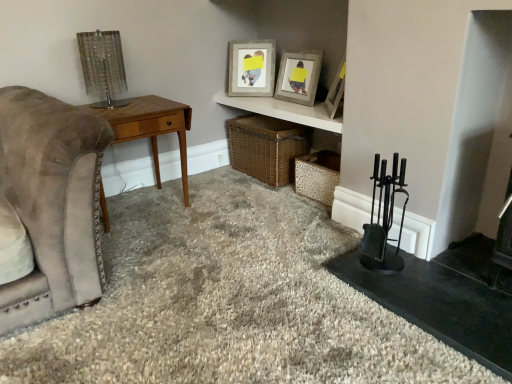
Describe the element at coordinates (151, 127) in the screenshot. I see `wooden desk at left` at that location.

Locate an element on the screen. wooden picture frame at upper center, which appears as the first picture frame when viewed from the right is located at coordinates (336, 91).

The width and height of the screenshot is (512, 384). I want to click on wooden picture frame at upper center, the second picture frame in the left-to-right sequence, so click(x=298, y=76).

Is woven brown basket at center, the second crate in the right-to-left sequence, inside the boundaries of wooden desk at left, or outside?

woven brown basket at center, the second crate in the right-to-left sequence, cannot be found inside wooden desk at left.

Is point (290, 154) more distant than point (143, 102)?

Yes, it is.

From a real-world perspective, is woven brown basket at center, which ranks as the first crate in left-to-right order, on wooden desk at left?

Incorrect, from a real-world perspective, woven brown basket at center, which ranks as the first crate in left-to-right order, is lower than wooden desk at left.

Does woven brown basket at center, which ranks as the first crate in left-to-right order, lie behind wooden desk at left?

Yes, woven brown basket at center, which ranks as the first crate in left-to-right order, is further from the viewer.

From a real-world perspective, which object rests below the other?

matte wooden shelf at upper center is physically lower.

Is metallic mesh lamp at upper left next to matte wooden shelf at upper center?

No.

Is metallic mesh lamp at upper left inside the boundaries of matte wooden shelf at upper center, or outside?

metallic mesh lamp at upper left is outside matte wooden shelf at upper center.

Is metallic mesh lamp at upper left surrounding wooden picture frame at upper center, which is counted as the first picture frame, starting from the left?

No, wooden picture frame at upper center, which is counted as the first picture frame, starting from the left, is located outside of metallic mesh lamp at upper left.

Considering the sizes of objects metallic mesh lamp at upper left and wooden picture frame at upper center, the 3th picture frame viewed from the right, in the image provided, who is thinner, metallic mesh lamp at upper left or wooden picture frame at upper center, the 3th picture frame viewed from the right,?

wooden picture frame at upper center, the 3th picture frame viewed from the right, is thinner.

Is point (108, 72) behind point (237, 79)?

No.

Is metallic mesh lamp at upper left beside wooden picture frame at upper center, the 3th picture frame viewed from the right?

No.

Which is in front, matte wooden shelf at upper center or wooden picture frame at upper center, which ranks as the third picture frame in left-to-right order?

wooden picture frame at upper center, which ranks as the third picture frame in left-to-right order, is more forward.

From the image's perspective, relative to wooden picture frame at upper center, which ranks as the third picture frame in left-to-right order, is matte wooden shelf at upper center above or below?

matte wooden shelf at upper center is below wooden picture frame at upper center, which ranks as the third picture frame in left-to-right order.

What's the angular difference between matte wooden shelf at upper center and wooden picture frame at upper center, which appears as the first picture frame when viewed from the right,'s facing directions?

39.2 degrees separate the facing orientations of matte wooden shelf at upper center and wooden picture frame at upper center, which appears as the first picture frame when viewed from the right.

Is wooden picture frame at upper center, which ranks as the third picture frame in left-to-right order, a part of matte wooden shelf at upper center?

No, wooden picture frame at upper center, which ranks as the third picture frame in left-to-right order, is not a part of matte wooden shelf at upper center.

Is wooden desk at left inside wooden picture frame at upper center, which appears as the first picture frame when viewed from the right?

Definitely not — wooden desk at left is not inside wooden picture frame at upper center, which appears as the first picture frame when viewed from the right.

Could you measure the distance between wooden picture frame at upper center, which ranks as the third picture frame in left-to-right order, and wooden desk at left?

wooden picture frame at upper center, which ranks as the third picture frame in left-to-right order, and wooden desk at left are 35.89 inches apart.

Between point (338, 72) and point (160, 124), which one is positioned in front?

The point (160, 124) is closer.

Locate an element on the screen. The height and width of the screenshot is (384, 512). picture frame that is the 2nd object above the wooden desk at left (from a real-world perspective) is located at coordinates (336, 91).

Is wooden picture frame at upper center, which is counted as the first picture frame, starting from the left, at the back of wooden picture frame at upper center, placed as the second picture frame when sorted from right to left?

No, wooden picture frame at upper center, placed as the second picture frame when sorted from right to left, is not facing away from wooden picture frame at upper center, which is counted as the first picture frame, starting from the left.

Which is more to the left, wooden picture frame at upper center, placed as the second picture frame when sorted from right to left, or wooden picture frame at upper center, the 3th picture frame viewed from the right?

wooden picture frame at upper center, the 3th picture frame viewed from the right, is more to the left.

From a real-world perspective, is wooden picture frame at upper center, the second picture frame in the left-to-right sequence, positioned under wooden picture frame at upper center, which is counted as the first picture frame, starting from the left, based on gravity?

Indeed, from a real-world perspective, wooden picture frame at upper center, the second picture frame in the left-to-right sequence, is positioned beneath wooden picture frame at upper center, which is counted as the first picture frame, starting from the left.

In order to click on lamp below the wooden picture frame at upper center, the second picture frame in the left-to-right sequence (from the image's perspective) in this screenshot , I will do `click(103, 67)`.

From a real-world perspective, between wooden picture frame at upper center, the second picture frame in the left-to-right sequence, and metallic mesh lamp at upper left, who is vertically lower?

wooden picture frame at upper center, the second picture frame in the left-to-right sequence, is physically lower.

Can you confirm if wooden picture frame at upper center, the second picture frame in the left-to-right sequence, is thinner than metallic mesh lamp at upper left?

Indeed, wooden picture frame at upper center, the second picture frame in the left-to-right sequence, has a lesser width compared to metallic mesh lamp at upper left.

Considering the sizes of wooden picture frame at upper center, the second picture frame in the left-to-right sequence, and metallic mesh lamp at upper left in the image, is wooden picture frame at upper center, the second picture frame in the left-to-right sequence, bigger or smaller than metallic mesh lamp at upper left?

Clearly, wooden picture frame at upper center, the second picture frame in the left-to-right sequence, is larger in size than metallic mesh lamp at upper left.

This screenshot has width=512, height=384. I want to click on the 1st crate positioned below the wooden desk at left (from a real-world perspective), so click(266, 147).

Identify the location of lamp in front of the matte wooden shelf at upper center. (103, 67).

Based on their spatial positions, is metallic textured crate at lower right, which is the 1th crate in right-to-left order, or metallic mesh lamp at upper left further from matte wooden shelf at upper center?

metallic mesh lamp at upper left is positioned further to the anchor matte wooden shelf at upper center.

Estimate the real-world distances between objects in this image. Which object is further from woven brown basket at center, which ranks as the first crate in left-to-right order, metallic textured crate at lower right, which is the 1th crate in right-to-left order, or wooden picture frame at upper center, the second picture frame in the left-to-right sequence?

wooden picture frame at upper center, the second picture frame in the left-to-right sequence, lies further to woven brown basket at center, which ranks as the first crate in left-to-right order, than the other object.

Based on their spatial positions, is metallic mesh lamp at upper left or wooden desk at left further from woven brown basket at center, the second crate in the right-to-left sequence?

metallic mesh lamp at upper left lies further to woven brown basket at center, the second crate in the right-to-left sequence, than the other object.

In the scene shown: When comparing their distances from wooden picture frame at upper center, which ranks as the third picture frame in left-to-right order, does metallic mesh lamp at upper left or matte wooden shelf at upper center seem further?

Among the two, metallic mesh lamp at upper left is located further to wooden picture frame at upper center, which ranks as the third picture frame in left-to-right order.

Considering their positions, is metallic textured crate at lower right, arranged as the 2th crate when viewed from the left, positioned further to metallic mesh lamp at upper left than matte wooden shelf at upper center?

metallic textured crate at lower right, arranged as the 2th crate when viewed from the left.

Which object lies further to the anchor point wooden desk at left, metallic mesh lamp at upper left or wooden picture frame at upper center, the 3th picture frame viewed from the right?

wooden picture frame at upper center, the 3th picture frame viewed from the right, is positioned further to the anchor wooden desk at left.

Consider the image. Which object lies nearer to the anchor point wooden picture frame at upper center, placed as the second picture frame when sorted from right to left, metallic mesh lamp at upper left or matte wooden shelf at upper center?

matte wooden shelf at upper center is positioned closer to the anchor wooden picture frame at upper center, placed as the second picture frame when sorted from right to left.

Estimate the real-world distances between objects in this image. Which object is further from wooden picture frame at upper center, which is counted as the first picture frame, starting from the left, wooden picture frame at upper center, placed as the second picture frame when sorted from right to left, or metallic mesh lamp at upper left?

Among the two, metallic mesh lamp at upper left is located further to wooden picture frame at upper center, which is counted as the first picture frame, starting from the left.

I want to click on crate situated between wooden desk at left and metallic textured crate at lower right, which is the 1th crate in right-to-left order, from left to right, so click(266, 147).

Where is `picture frame located between matte wooden shelf at upper center and woven brown basket at center, which ranks as the first crate in left-to-right order, in the depth direction`? Image resolution: width=512 pixels, height=384 pixels. picture frame located between matte wooden shelf at upper center and woven brown basket at center, which ranks as the first crate in left-to-right order, in the depth direction is located at coordinates (298, 76).

I want to click on cabinetry between wooden picture frame at upper center, which is counted as the first picture frame, starting from the left, and metallic textured crate at lower right, arranged as the 2th crate when viewed from the left, in the up-down direction, so click(284, 111).

Where is `cabinetry between wooden desk at left and wooden picture frame at upper center, which ranks as the third picture frame in left-to-right order`? This screenshot has height=384, width=512. cabinetry between wooden desk at left and wooden picture frame at upper center, which ranks as the third picture frame in left-to-right order is located at coordinates (284, 111).